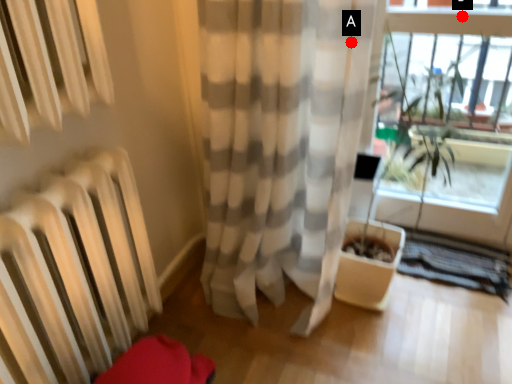
Question: Two points are circled on the image, labeled by A and B beside each circle. Which point appears closest to the camera in this image?

Choices:
 (A) A is closer
 (B) B is closer

Answer: (A)